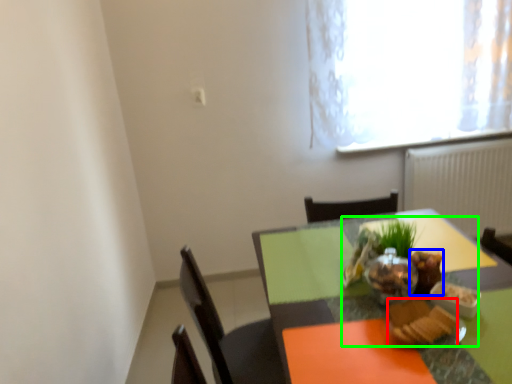
Question: Which object is the closest to the food (highlighted by a red box)? Choose among these: food (highlighted by a blue box) or meal (highlighted by a green box).

Choices:
 (A) food
 (B) meal

Answer: (B)